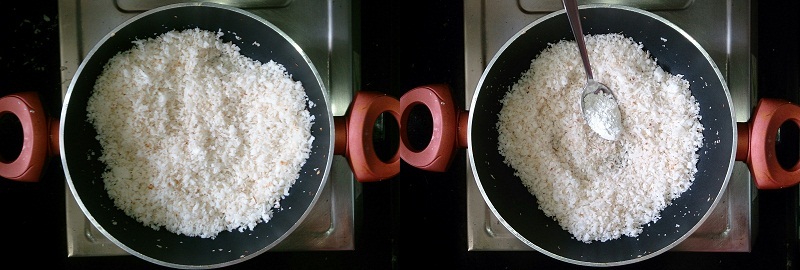
The width and height of the screenshot is (800, 270). I want to click on corner, so click(62, 255), click(350, 242), click(466, 241), click(746, 242).